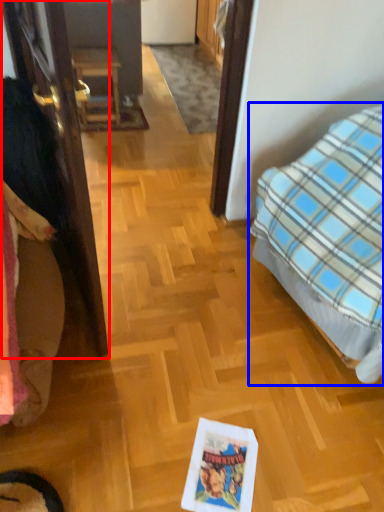
Question: Which object appears farthest to the camera in this image, door (highlighted by a red box) or bed (highlighted by a blue box)?

Choices:
 (A) door
 (B) bed

Answer: (A)